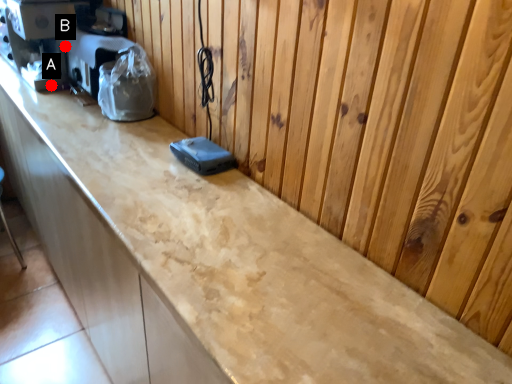
Question: Two points are circled on the image, labeled by A and B beside each circle. Which point appears closest to the camera in this image?

Choices:
 (A) A is closer
 (B) B is closer

Answer: (B)